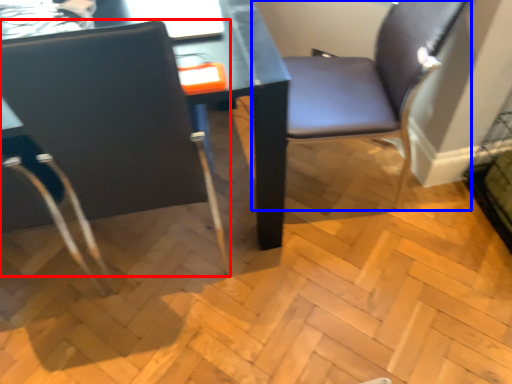
Question: Which object is closer to the camera taking this photo, chair (highlighted by a red box) or chair (highlighted by a blue box)?

Choices:
 (A) chair
 (B) chair

Answer: (A)